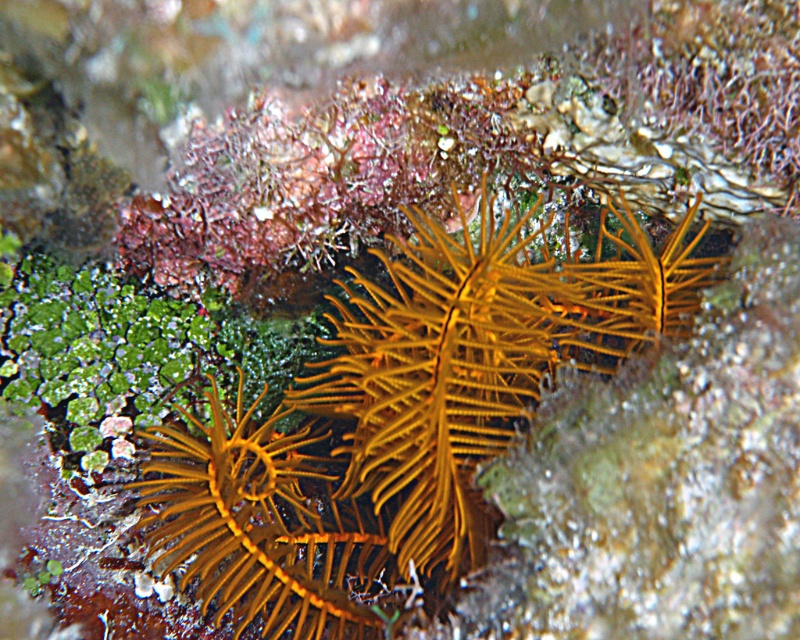
In the scene shown: You are a scuba diver who wants to take a photo of the yellow spiny anemone at center without getting too close. If your camera has a maximum focus range of 28 inches, will you be able to capture it clearly from your current position?

The yellow spiny anemone at center is 27.92 inches away from the viewer, which is within the camera maximum focus range of 28 inches. Therefore, you can capture it clearly without moving closer.